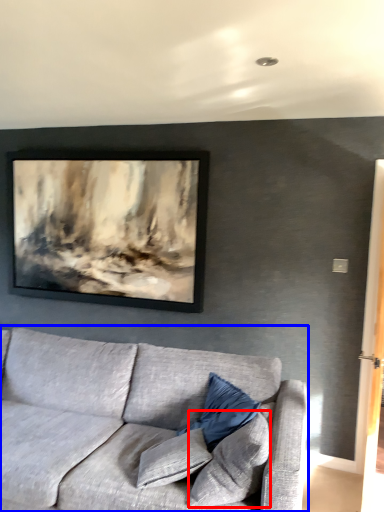
Question: Which object appears closest to the camera in this image, pillow (highlighted by a red box) or studio couch (highlighted by a blue box)?

Choices:
 (A) pillow
 (B) studio couch

Answer: (B)